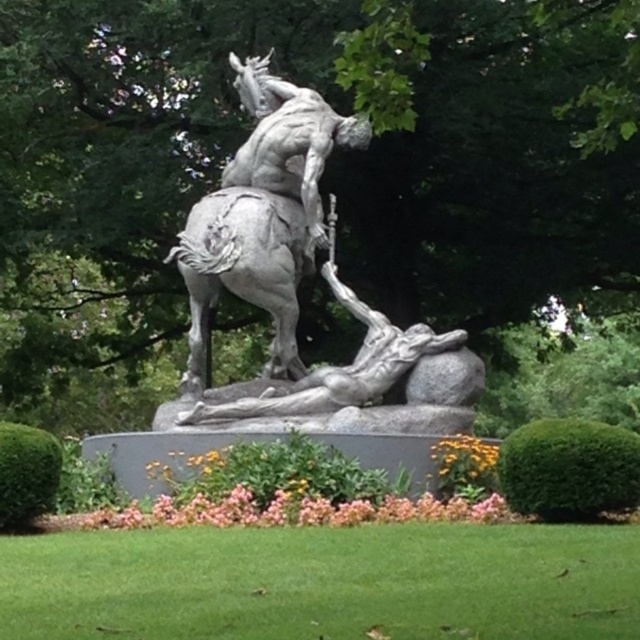
Question: Does gray stone horse at center appear on the left side of polished bronze rider at upper center?

Choices:
 (A) yes
 (B) no

Answer: (A)

Question: Based on their relative distances, which object is nearer to the polished bronze statue at center?

Choices:
 (A) gray stone horse at center
 (B) polished bronze rider at upper center

Answer: (A)

Question: Which object appears farthest from the camera in this image?

Choices:
 (A) polished bronze statue at center
 (B) polished bronze rider at upper center
 (C) gray stone horse at center

Answer: (B)

Question: Observing the image, what is the correct spatial positioning of polished bronze statue at center in reference to gray stone horse at center?

Choices:
 (A) left
 (B) right

Answer: (B)

Question: Which object is closer to the camera taking this photo?

Choices:
 (A) gray stone horse at center
 (B) polished bronze rider at upper center
 (C) polished bronze statue at center

Answer: (C)

Question: Considering the relative positions of polished bronze statue at center and gray stone horse at center in the image provided, where is polished bronze statue at center located with respect to gray stone horse at center?

Choices:
 (A) left
 (B) right

Answer: (B)